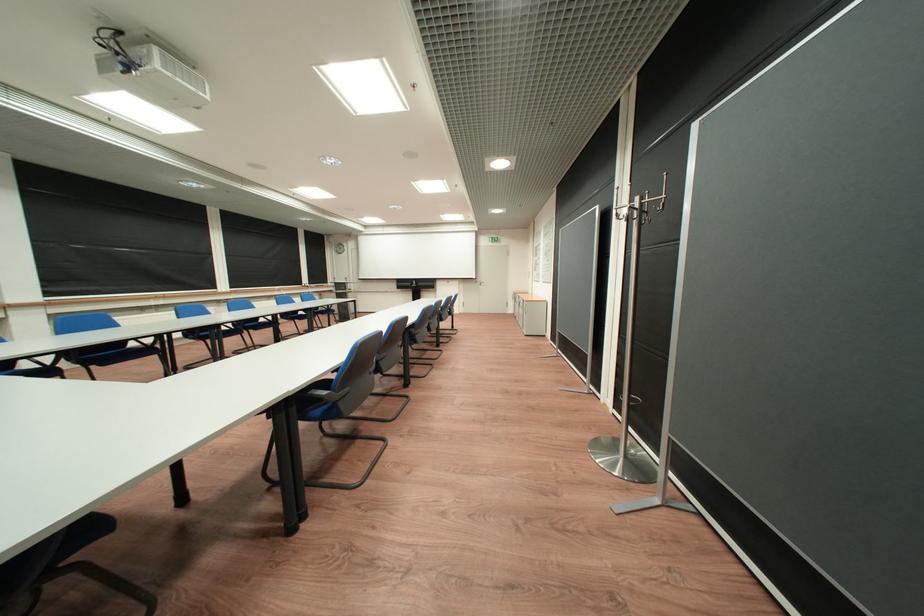
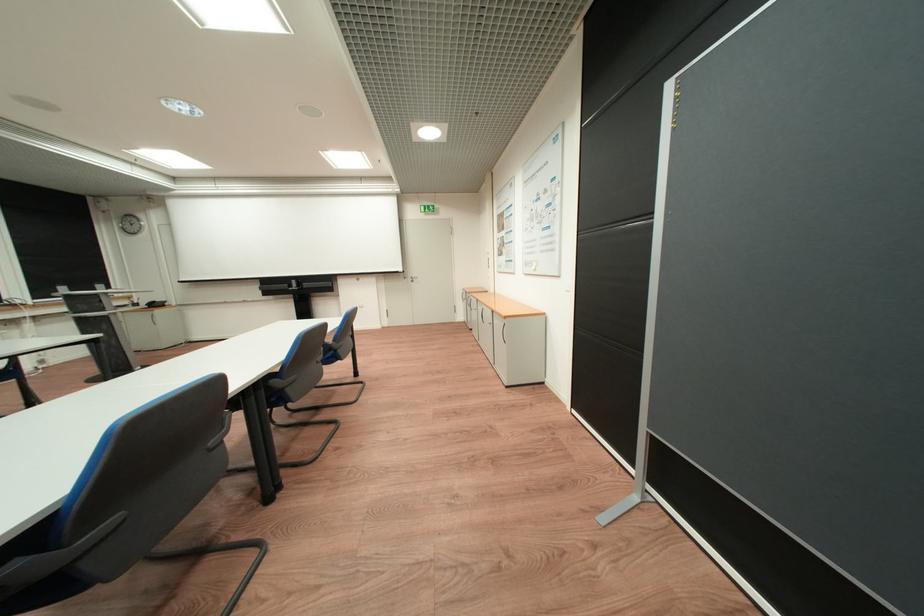
Question: Which direction would the cameraman need to move to produce the second image? Reply with the corresponding letter.

Choices:
 (A) Left
 (B) Right
 (C) Forward
 (D) Backward

Answer: (C)